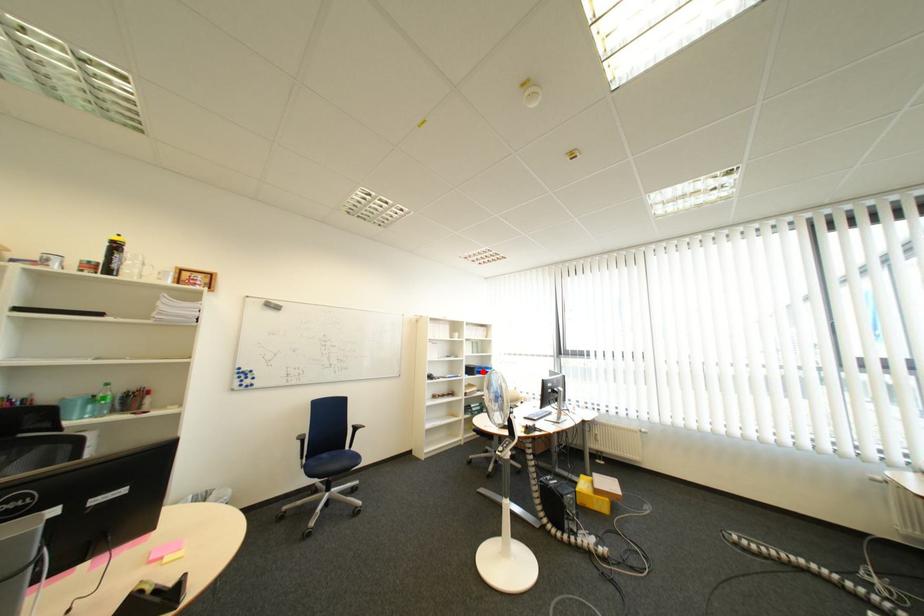
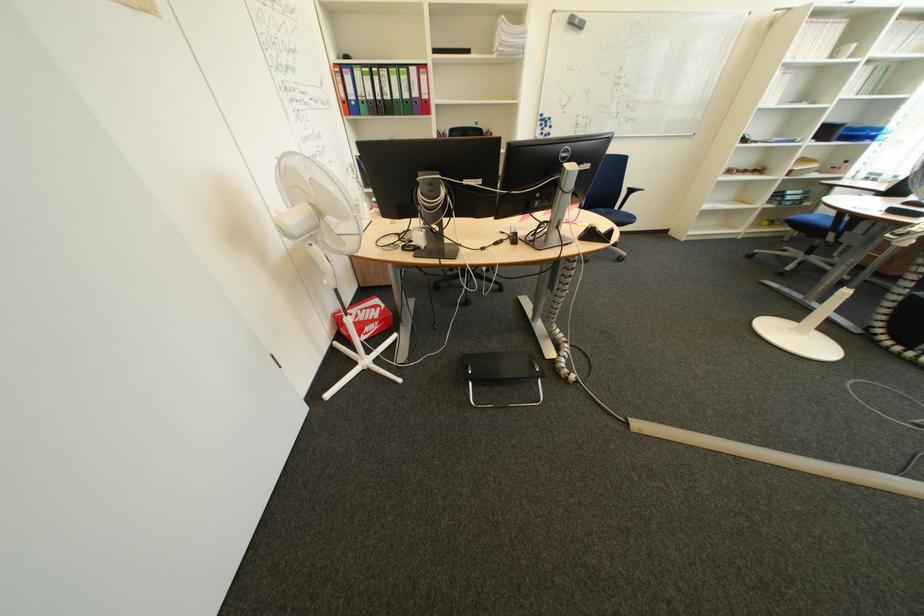
Find the pixel in the second image that matches the highlighted location in the first image.

(840, 132)